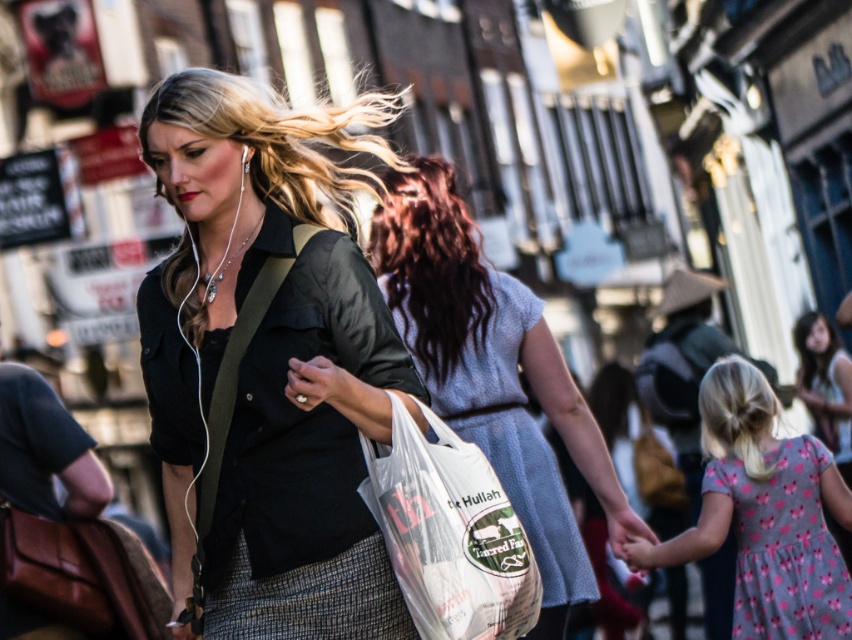
Is white plastic grocery bag at center to the left of pink floral fabric dress at lower right from the viewer's perspective?

Yes, white plastic grocery bag at center is to the left of pink floral fabric dress at lower right.

Which is behind, point (504, 612) or point (826, 541)?

Point (826, 541)

The height and width of the screenshot is (640, 852). I want to click on white plastic grocery bag at center, so click(x=448, y=532).

Is matte black shirt at center shorter than white plastic grocery bag at center?

Incorrect, matte black shirt at center's height does not fall short of white plastic grocery bag at center's.

Which is below, matte black shirt at center or white plastic grocery bag at center?

white plastic grocery bag at center

Which is behind, point (280, 173) or point (436, 468)?

Positioned behind is point (280, 173).

Identify the location of matte black shirt at center. (269, 362).

Does matte black shirt at center have a greater height compared to pink floral fabric dress at lower right?

Correct, matte black shirt at center is much taller as pink floral fabric dress at lower right.

Is matte black shirt at center wider than pink floral fabric dress at lower right?

Yes.

Who is more distant from viewer, (216, 170) or (780, 586)?

Point (780, 586)

The width and height of the screenshot is (852, 640). I want to click on matte black shirt at center, so click(269, 362).